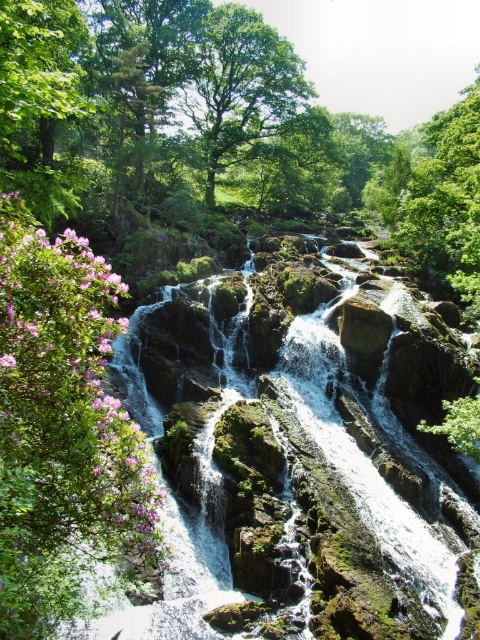
Question: Among these objects, which one is farthest from the camera?

Choices:
 (A) pink matte flower at left
 (B) green leafy tree at upper center
 (C) green mossy rocks at center

Answer: (B)

Question: Can you confirm if green mossy rocks at center is wider than pink matte flower at left?

Choices:
 (A) yes
 (B) no

Answer: (A)

Question: Among these points, which one is farthest from the camera?

Choices:
 (A) (298, 72)
 (B) (71, 390)
 (C) (159, 509)

Answer: (A)

Question: Considering the relative positions of pink matte flower at left and green leafy tree at upper center in the image provided, where is pink matte flower at left located with respect to green leafy tree at upper center?

Choices:
 (A) right
 (B) left

Answer: (B)

Question: Can you confirm if pink matte flower at left is positioned below green leafy tree at upper center?

Choices:
 (A) no
 (B) yes

Answer: (B)

Question: Which object is closer to the camera taking this photo?

Choices:
 (A) green leafy tree at upper center
 (B) pink matte flower at left

Answer: (B)